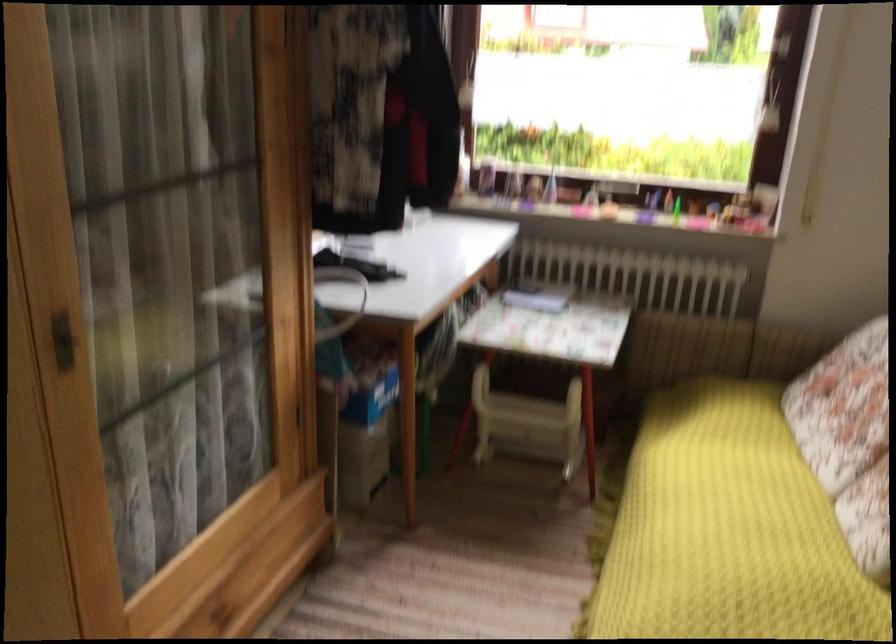
At what (x,y) coordinates should I click in order to perform the action: click on sofa sitting surface. Please return your answer as a coordinate pair (x, y). The image size is (896, 644). Looking at the image, I should click on (728, 529).